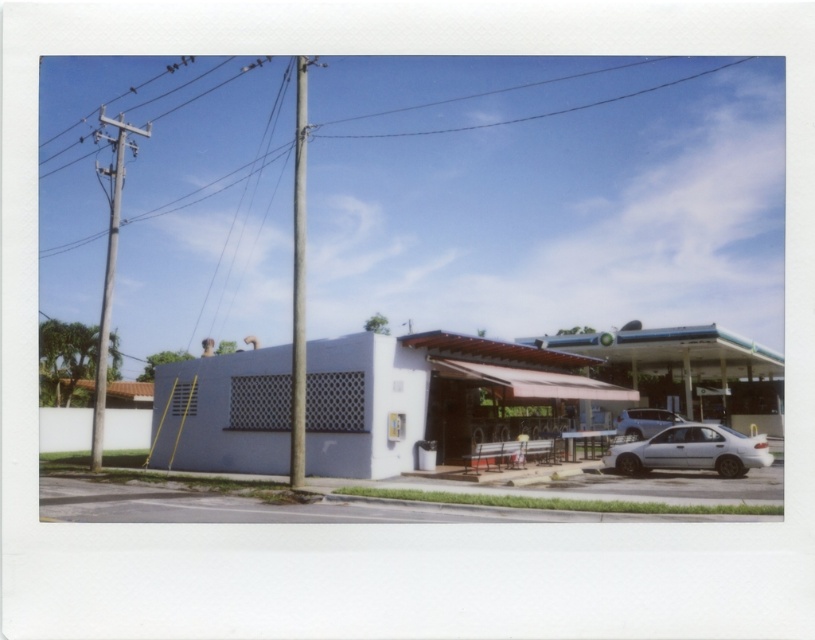
Question: Which point is farther from the camera taking this photo?

Choices:
 (A) (130, 131)
 (B) (635, 412)
 (C) (403, 134)
 (D) (684, 438)

Answer: (C)

Question: Which point appears closest to the camera in this image?

Choices:
 (A) pyautogui.click(x=628, y=412)
 (B) pyautogui.click(x=685, y=81)
 (C) pyautogui.click(x=302, y=138)

Answer: (C)

Question: Observing the image, what is the correct spatial positioning of gray concrete utility pole at left in reference to silver metallic car at right?

Choices:
 (A) left
 (B) right

Answer: (A)

Question: Is metallic gray pole at center further to camera compared to silver metallic car at right?

Choices:
 (A) yes
 (B) no

Answer: (B)

Question: Which point appears farthest from the camera in this image?

Choices:
 (A) (622, 472)
 (B) (109, 285)
 (C) (653, 419)

Answer: (C)

Question: Can you confirm if metallic gray pole at center is smaller than clear wire at upper center?

Choices:
 (A) yes
 (B) no

Answer: (B)